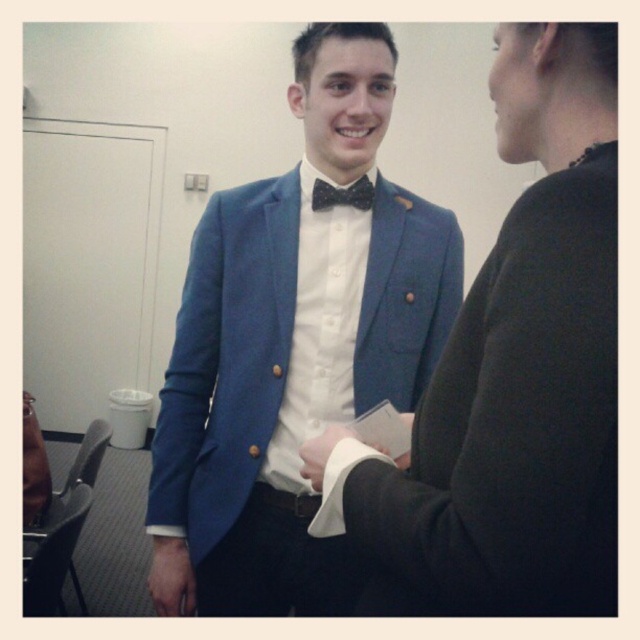
You are standing at the origin point of the room. The door is located at coordinate point 0.5, 0.5. You need to walk to the matte blue suit at center. Which direction should you move in?

The matte blue suit at center is located at coordinate point (292, 344). Since the door is at (320, 320), you should move slightly to the right and down to reach the matte blue suit at center.

You are standing at the origin point of the room. The door is located at coordinate point 0.5, 0.5. You need to walk to the matte blue suit at center. Which direction should you move first?

Since the door is at coordinate point [320,320] and the matte blue suit at center is at point [292,344], you should move slightly to the left and down to reach the matte blue suit at center.